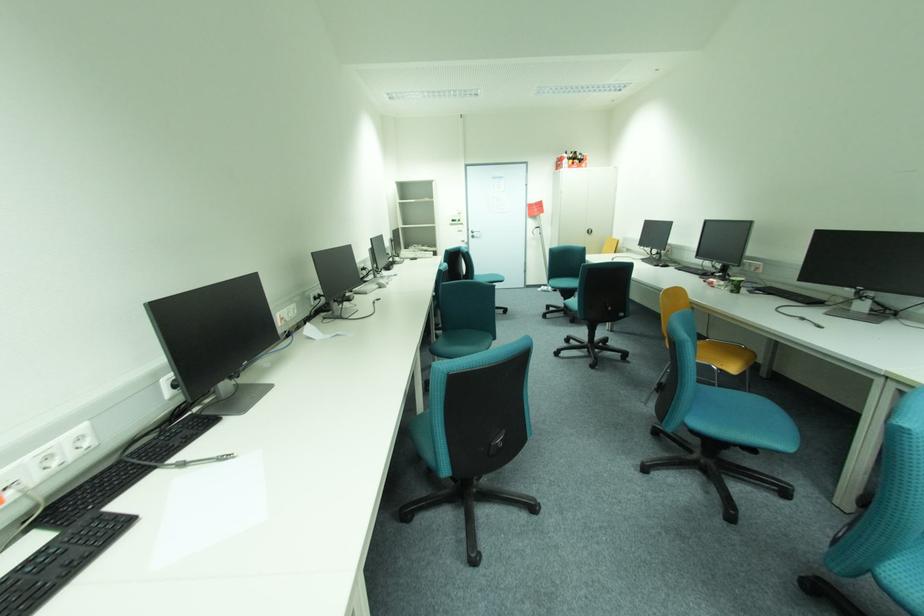
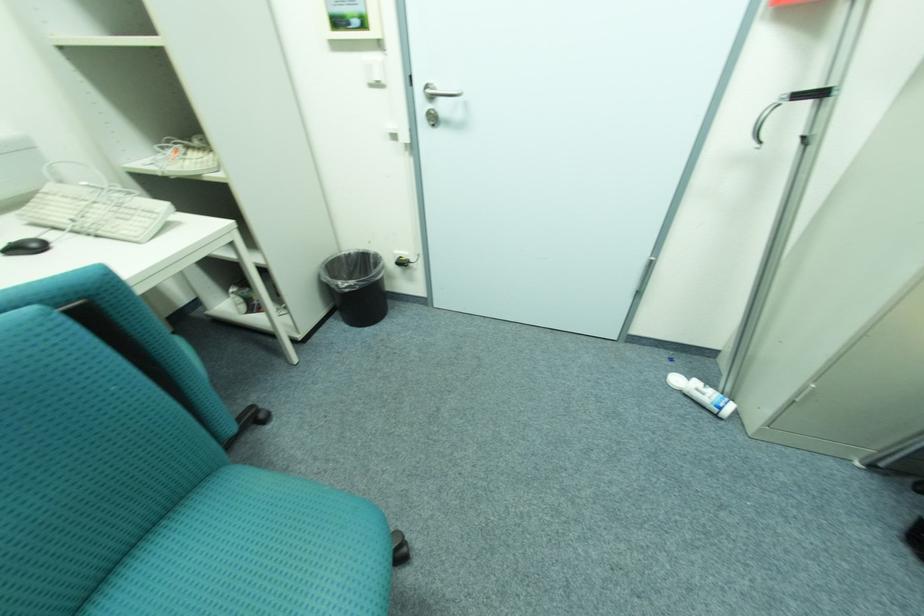
Locate, in the second image, the point that corresponds to point (479, 233) in the first image.

(439, 97)